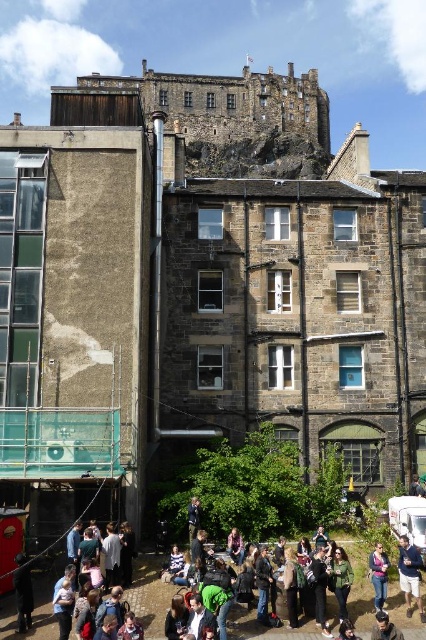
From the picture: You are standing in the courtyard and want to walk to the point closer to you between point (374,588) and point (189,532). Which point should you head towards?

You should head towards point (374,588) because it is closer to you than point (189,532).

You are standing in the courtyard surrounded by historic stone buildings. You see a black leather jacket at lower left and a denim jacket at lower right. If you want to pick up both jackets, which one is closer to you?

The black leather jacket at lower left is 11.46 meters away from the denim jacket at lower right. Therefore, you are equidistant from both jackets, so neither is closer.